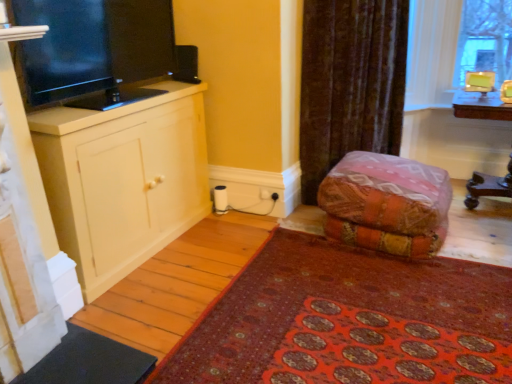
Question: Does black glossy tv at left have a lesser width compared to red carpet at lower right?

Choices:
 (A) yes
 (B) no

Answer: (A)

Question: Is black glossy tv at left bigger than red carpet at lower right?

Choices:
 (A) no
 (B) yes

Answer: (A)

Question: Is black glossy tv at left completely or partially outside of red carpet at lower right?

Choices:
 (A) no
 (B) yes

Answer: (B)

Question: Is red carpet at lower right completely or partially inside black glossy tv at left?

Choices:
 (A) yes
 (B) no

Answer: (B)

Question: Is black glossy tv at left facing towards red carpet at lower right?

Choices:
 (A) yes
 (B) no

Answer: (B)

Question: Is wooden table at right inside the boundaries of textured orange fabric at center, or outside?

Choices:
 (A) inside
 (B) outside

Answer: (B)

Question: Based on their positions, is wooden table at right located to the left or right of textured orange fabric at center?

Choices:
 (A) left
 (B) right

Answer: (B)

Question: In terms of size, does wooden table at right appear bigger or smaller than textured orange fabric at center?

Choices:
 (A) small
 (B) big

Answer: (A)

Question: From the image's perspective, is wooden table at right above or below textured orange fabric at center?

Choices:
 (A) below
 (B) above

Answer: (B)

Question: Would you say black glossy tv at left is to the left or to the right of matte white cabinet at left in the picture?

Choices:
 (A) right
 (B) left

Answer: (A)

Question: Choose the correct answer: Is black glossy tv at left inside matte white cabinet at left or outside it?

Choices:
 (A) outside
 (B) inside

Answer: (A)

Question: Based on their sizes in the image, would you say black glossy tv at left is bigger or smaller than matte white cabinet at left?

Choices:
 (A) big
 (B) small

Answer: (B)

Question: Is point (25, 21) closer or farther from the camera than point (113, 233)?

Choices:
 (A) farther
 (B) closer

Answer: (B)

Question: Relative to black glossy tv at left, is matte white cabinet at left in front or behind?

Choices:
 (A) front
 (B) behind

Answer: (B)

Question: Based on their positions, is matte white cabinet at left located to the left or right of black glossy tv at left?

Choices:
 (A) left
 (B) right

Answer: (A)